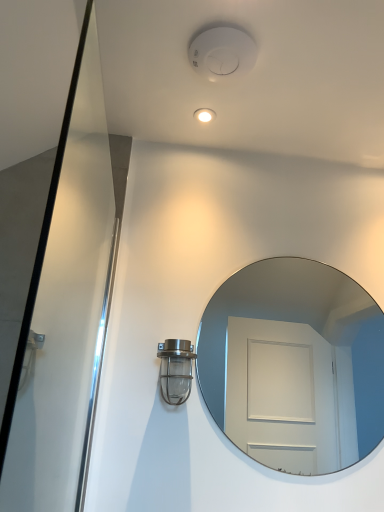
This screenshot has height=512, width=384. What do you see at coordinates (176, 370) in the screenshot?
I see `metallic glass light fixture at lower left` at bounding box center [176, 370].

Identify the location of metallic glass light fixture at lower left. (176, 370).

Identify the location of clear glass mirror at center. (294, 365).

Describe the element at coordinates (294, 365) in the screenshot. The width and height of the screenshot is (384, 512). I see `clear glass mirror at center` at that location.

In order to face clear glass mirror at center, should I rotate leftwards or rightwards?

A 14.331 degree turn to the right will do.

What is the approximate width of clear glass mirror at center?

It is 1.26 inches.

Where is `metallic glass light fixture at lower left`? metallic glass light fixture at lower left is located at coordinates (176, 370).

Which is more to the right, metallic glass light fixture at lower left or clear glass mirror at center?

clear glass mirror at center.

Is the depth of metallic glass light fixture at lower left less than that of clear glass mirror at center?

Yes, it is in front of clear glass mirror at center.

Which is in front, point (175, 398) or point (373, 433)?

The point (175, 398) is more forward.

From the image's perspective, would you say metallic glass light fixture at lower left is positioned over clear glass mirror at center?

No, from the image's perspective, metallic glass light fixture at lower left is not on top of clear glass mirror at center.

From a real-world perspective, is metallic glass light fixture at lower left positioned under clear glass mirror at center based on gravity?

Yes, from a real-world perspective, metallic glass light fixture at lower left is under clear glass mirror at center.

Which object is thinner, metallic glass light fixture at lower left or clear glass mirror at center?

With smaller width is clear glass mirror at center.

Who is shorter, metallic glass light fixture at lower left or clear glass mirror at center?

metallic glass light fixture at lower left is shorter.

Is metallic glass light fixture at lower left smaller than clear glass mirror at center?

Indeed, metallic glass light fixture at lower left has a smaller size compared to clear glass mirror at center.

Could clear glass mirror at center be considered to be inside metallic glass light fixture at lower left?

Definitely not — clear glass mirror at center is not inside metallic glass light fixture at lower left.

Are metallic glass light fixture at lower left and clear glass mirror at center located far from each other?

Indeed, metallic glass light fixture at lower left is not near clear glass mirror at center.

Is metallic glass light fixture at lower left oriented away from clear glass mirror at center?

No.

How distant is metallic glass light fixture at lower left from clear glass mirror at center?

metallic glass light fixture at lower left is 4.77 feet from clear glass mirror at center.

Where is `mirror located on the right of metallic glass light fixture at lower left`? mirror located on the right of metallic glass light fixture at lower left is located at coordinates (294, 365).

Based on their positions, is clear glass mirror at center located to the left or right of metallic glass light fixture at lower left?

Based on their positions, clear glass mirror at center is located to the right of metallic glass light fixture at lower left.

Is clear glass mirror at center in front of or behind metallic glass light fixture at lower left in the image?

clear glass mirror at center is positioned farther from the viewer than metallic glass light fixture at lower left.

Is point (283, 454) farther from viewer compared to point (174, 388)?

Yes, point (283, 454) is behind point (174, 388).

From the image's perspective, is clear glass mirror at center on metallic glass light fixture at lower left?

Yes.

From a real-world perspective, which is physically below, clear glass mirror at center or metallic glass light fixture at lower left?

metallic glass light fixture at lower left.

Is clear glass mirror at center thinner than metallic glass light fixture at lower left?

Indeed, clear glass mirror at center has a lesser width compared to metallic glass light fixture at lower left.

Between clear glass mirror at center and metallic glass light fixture at lower left, which one has more height?

clear glass mirror at center.

Looking at the image, does clear glass mirror at center seem bigger or smaller compared to metallic glass light fixture at lower left?

Clearly, clear glass mirror at center is larger in size than metallic glass light fixture at lower left.

Is metallic glass light fixture at lower left inside clear glass mirror at center?

No, metallic glass light fixture at lower left is not a part of clear glass mirror at center.

Are clear glass mirror at center and metallic glass light fixture at lower left located far from each other?

clear glass mirror at center is positioned a significant distance from metallic glass light fixture at lower left.

Is clear glass mirror at center facing away from metallic glass light fixture at lower left?

clear glass mirror at center is not turned away from metallic glass light fixture at lower left.

Where is `light fixture below the clear glass mirror at center (from the image's perspective)`? This screenshot has width=384, height=512. light fixture below the clear glass mirror at center (from the image's perspective) is located at coordinates (176, 370).

This screenshot has height=512, width=384. I want to click on mirror above the metallic glass light fixture at lower left (from the image's perspective), so tap(294, 365).

I want to click on mirror above the metallic glass light fixture at lower left (from a real-world perspective), so click(294, 365).